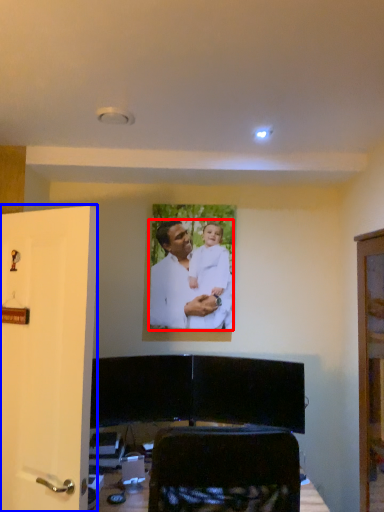
Question: Among these objects, which one is nearest to the camera, man (highlighted by a red box) or door (highlighted by a blue box)?

Choices:
 (A) man
 (B) door

Answer: (B)